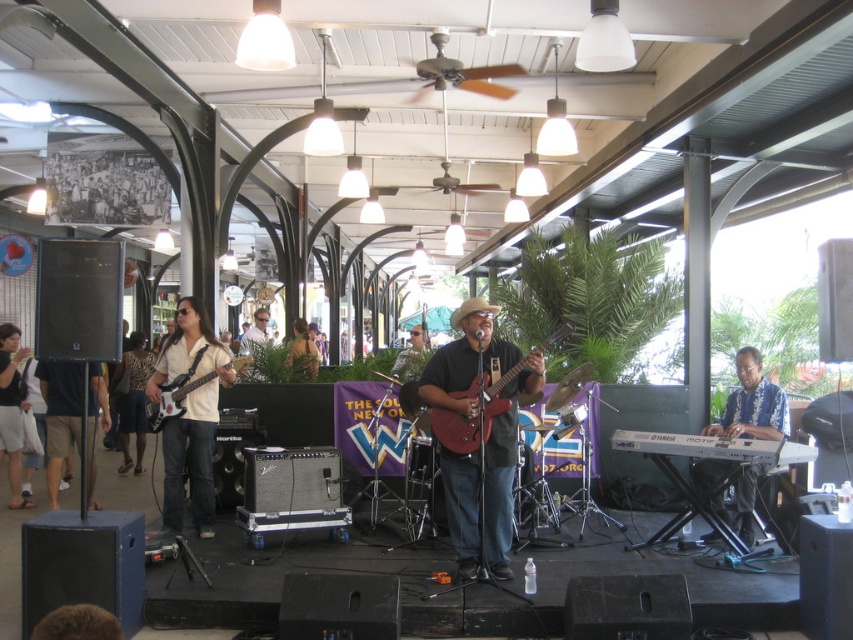
Based on the photo, you are setting up a music stand between the matte red electric guitar at center and the smooth brown guitar at center. Which guitar should you place closer to the stand to ensure there is enough space for both?

The smooth brown guitar at center should be placed closer to the stand because the matte red electric guitar at center is wider, requiring more space between them.

You are a photographer trying to capture the musician in khaki shorts at left and the smooth brown guitar at center in the same frame. Which object should you focus on first to ensure both are in the frame?

The smooth brown guitar at center is larger than the khaki shorts at left, so focusing on the smooth brown guitar at center first will help ensure both objects are included in the frame.

You are a photographer at the music event and want to capture the two guitars in the scene. Which guitar, the matte red electric guitar at center or the smooth brown guitar at center, appears taller in the photo?

The matte red electric guitar at center appears taller than the smooth brown guitar at center in the photo.